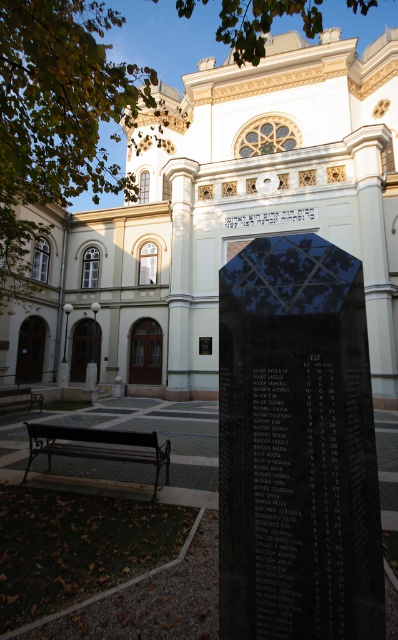
Does white stone church at center appear on the right side of brown wooden bench at lower left?

Yes, white stone church at center is to the right of brown wooden bench at lower left.

From the picture: Who is shorter, white stone church at center or brown wooden bench at lower left?

brown wooden bench at lower left is shorter.

The image size is (398, 640). What are the coordinates of `white stone church at center` in the screenshot? It's located at (222, 218).

Between white stone church at center and black metal bench at lower left, which one has less height?

black metal bench at lower left

Who is more distant from viewer, (339, 60) or (128, 433)?

Positioned behind is point (339, 60).

Is point (204, 182) positioned in front of point (33, 442)?

No, it is not.

What are the coordinates of `white stone church at center` in the screenshot? It's located at (222, 218).

Is white stone church at center above black polished stone monument at center?

Correct, white stone church at center is located above black polished stone monument at center.

Based on the photo, who is higher up, white stone church at center or black polished stone monument at center?

white stone church at center

Is point (111, 230) farther from camera compared to point (319, 548)?

Yes, it is behind point (319, 548).

Find the location of a particular element. Image resolution: width=398 pixels, height=640 pixels. white stone church at center is located at coordinates (222, 218).